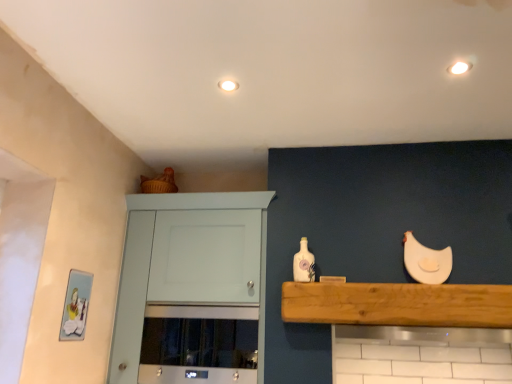
Question: Is white painted wood cabinet at upper left not inside white matte light fixture at upper center, which is the second lighting from front to back?

Choices:
 (A) no
 (B) yes

Answer: (B)

Question: Considering the relative sizes of white painted wood cabinet at upper left and white matte light fixture at upper center, acting as the 2th lighting starting from the right, in the image provided, is white painted wood cabinet at upper left smaller than white matte light fixture at upper center, acting as the 2th lighting starting from the right,?

Choices:
 (A) yes
 (B) no

Answer: (B)

Question: Are white painted wood cabinet at upper left and white matte light fixture at upper center, the 1th lighting viewed from the left, beside each other?

Choices:
 (A) yes
 (B) no

Answer: (B)

Question: From the image's perspective, is white painted wood cabinet at upper left above white matte light fixture at upper center, placed as the first lighting when sorted from back to front?

Choices:
 (A) yes
 (B) no

Answer: (B)

Question: Does white painted wood cabinet at upper left appear on the left side of white matte light fixture at upper center, the 1th lighting viewed from the left?

Choices:
 (A) no
 (B) yes

Answer: (B)

Question: Is white glossy bottle at center inside the boundaries of white matte light fixture at upper center, placed as the first lighting when sorted from back to front, or outside?

Choices:
 (A) inside
 (B) outside

Answer: (B)

Question: In terms of size, does white glossy bottle at center appear bigger or smaller than white matte light fixture at upper center, acting as the 2th lighting starting from the right?

Choices:
 (A) big
 (B) small

Answer: (A)

Question: Visually, is white glossy bottle at center positioned to the left or to the right of white matte light fixture at upper center, placed as the first lighting when sorted from back to front?

Choices:
 (A) left
 (B) right

Answer: (B)

Question: From a real-world perspective, is white glossy bottle at center positioned above or below white matte light fixture at upper center, placed as the first lighting when sorted from back to front?

Choices:
 (A) below
 (B) above

Answer: (A)

Question: From the image's perspective, relative to white matte light fixture at upper center, which is the second lighting from front to back, is white glossy light fixture at upper right, the second lighting when ordered from back to front, above or below?

Choices:
 (A) above
 (B) below

Answer: (A)

Question: Considering the positions of point (468, 66) and point (222, 82), is point (468, 66) closer or farther from the camera than point (222, 82)?

Choices:
 (A) farther
 (B) closer

Answer: (B)

Question: From a real-world perspective, is white glossy light fixture at upper right, placed as the first lighting when sorted from right to left, physically located above or below white matte light fixture at upper center, acting as the 2th lighting starting from the right?

Choices:
 (A) below
 (B) above

Answer: (A)

Question: From their relative heights in the image, would you say white glossy light fixture at upper right, acting as the 1th lighting starting from the front, is taller or shorter than white matte light fixture at upper center, placed as the first lighting when sorted from back to front?

Choices:
 (A) short
 (B) tall

Answer: (A)

Question: From a real-world perspective, is white matte chicken at upper right positioned above or below white glossy light fixture at upper right, the second lighting when ordered from back to front?

Choices:
 (A) above
 (B) below

Answer: (B)

Question: Based on their positions, is white matte chicken at upper right located to the left or right of white glossy light fixture at upper right, positioned as the 2th lighting in left-to-right order?

Choices:
 (A) left
 (B) right

Answer: (B)